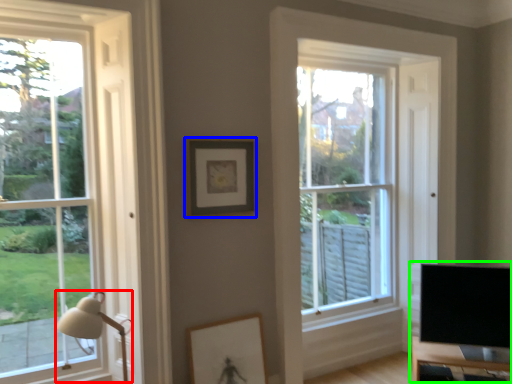
Question: Based on their relative distances, which object is nearer to table lamp (highlighted by a red box)? Choose from picture frame (highlighted by a blue box) and entertainment center (highlighted by a green box).

Choices:
 (A) picture frame
 (B) entertainment center

Answer: (A)